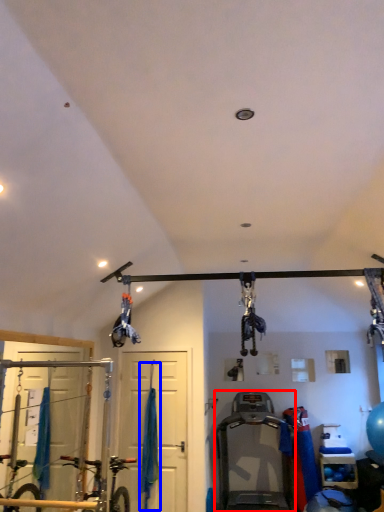
Question: Which of the following is the farthest to the observer, treadmill (highlighted by a red box) or curtain (highlighted by a blue box)?

Choices:
 (A) treadmill
 (B) curtain

Answer: (B)